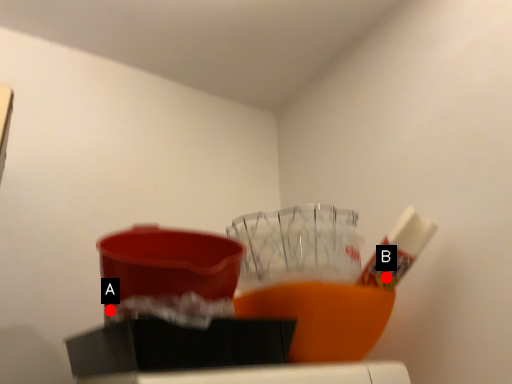
Question: Two points are circled on the image, labeled by A and B beside each circle. Among these points, which one is farthest from the camera?

Choices:
 (A) A is further
 (B) B is further

Answer: (B)